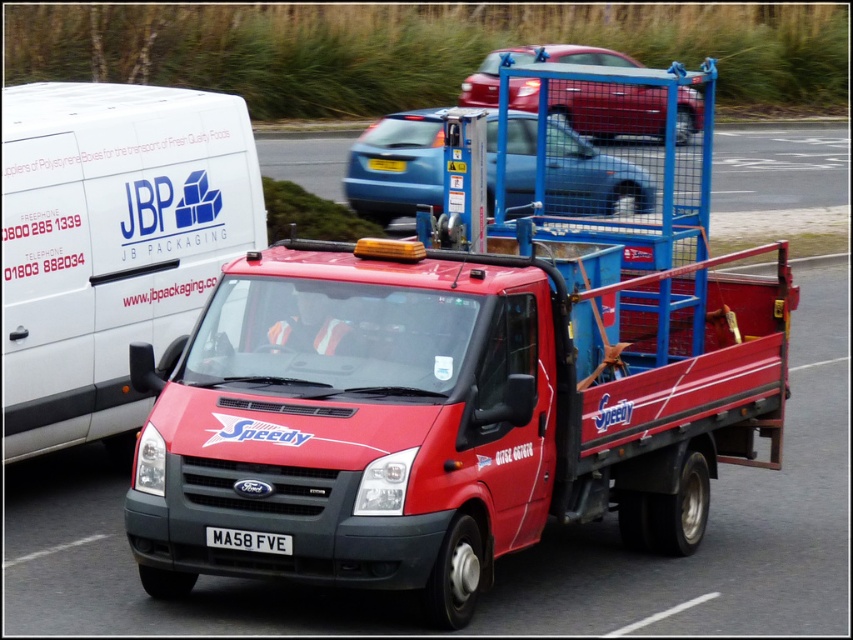
Question: Is red matte truck at center further to the viewer compared to metallic red car at center?

Choices:
 (A) yes
 (B) no

Answer: (B)

Question: Estimate the real-world distances between objects in this image. Which object is farther from the white plastic license plate at center?

Choices:
 (A) metallic red car at center
 (B) white matte van at left
 (C) red matte truck at center
 (D) blue metallic car at center

Answer: (A)

Question: Which object appears farthest from the camera in this image?

Choices:
 (A) red matte truck at center
 (B) metallic red car at center
 (C) white matte van at left
 (D) blue metallic car at center

Answer: (B)

Question: Is red matte truck at center above white matte van at left?

Choices:
 (A) yes
 (B) no

Answer: (B)

Question: Does white matte van at left have a greater width compared to metallic red car at center?

Choices:
 (A) no
 (B) yes

Answer: (A)

Question: Which point is closer to the camera taking this photo?

Choices:
 (A) (466, 77)
 (B) (119, 307)

Answer: (B)